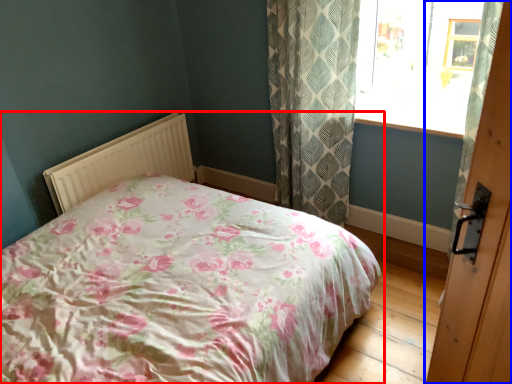
Question: Which object appears farthest to the camera in this image, bed (highlighted by a red box) or door (highlighted by a blue box)?

Choices:
 (A) bed
 (B) door

Answer: (B)